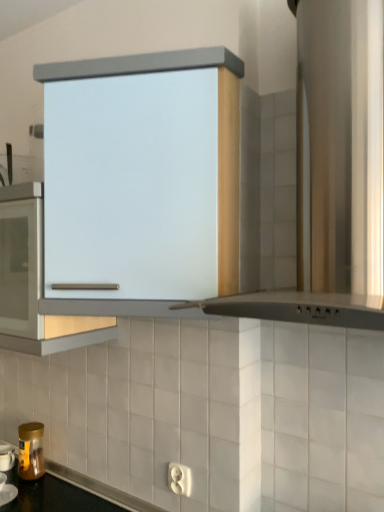
Locate an element on the screen. The width and height of the screenshot is (384, 512). satin white cabinet at center is located at coordinates (218, 128).

What is the approximate height of gold metallic jar at lower left?

7.99 inches.

This screenshot has height=512, width=384. In order to click on gold metallic jar at lower left in this screenshot , I will do `click(31, 451)`.

Where is `satin white cabinet at center`? The height and width of the screenshot is (512, 384). satin white cabinet at center is located at coordinates (218, 128).

Is satin silver hood at upper center oriented towards gold metallic jar at lower left?

No, satin silver hood at upper center is not turned towards gold metallic jar at lower left.

In the image, is satin silver hood at upper center positioned in front of or behind gold metallic jar at lower left?

In the image, satin silver hood at upper center appears in front of gold metallic jar at lower left.

From a real-world perspective, is satin silver hood at upper center beneath gold metallic jar at lower left?

No, from a real-world perspective, satin silver hood at upper center is not beneath gold metallic jar at lower left.

Consider the image. Is satin silver hood at upper center completely or partially outside of gold metallic jar at lower left?

That's correct, satin silver hood at upper center is outside of gold metallic jar at lower left.

Which is more to the left, gold metallic jar at lower left or satin silver hood at upper center?

gold metallic jar at lower left is more to the left.

In the scene shown: How far apart are gold metallic jar at lower left and satin silver hood at upper center?

They are 4.25 feet apart.

From the image's perspective, who appears lower, gold metallic jar at lower left or satin silver hood at upper center?

gold metallic jar at lower left.

Between gold metallic jar at lower left and satin silver hood at upper center, which one has more height?

With more height is satin silver hood at upper center.

Can you confirm if gold metallic jar at lower left is taller than satin white cabinet at center?

No, gold metallic jar at lower left is not taller than satin white cabinet at center.

Is gold metallic jar at lower left far away from satin white cabinet at center?

No, gold metallic jar at lower left is not far away from satin white cabinet at center.

Considering the relative sizes of gold metallic jar at lower left and satin white cabinet at center in the image provided, is gold metallic jar at lower left smaller than satin white cabinet at center?

Yes, gold metallic jar at lower left is smaller than satin white cabinet at center.

From the picture: Considering the sizes of objects gold metallic jar at lower left and satin white cabinet at center in the image provided, who is thinner, gold metallic jar at lower left or satin white cabinet at center?

Thinner between the two is gold metallic jar at lower left.

Between satin white cabinet at center and satin silver hood at upper center, which one has less height?

Standing shorter between the two is satin white cabinet at center.

From a real-world perspective, relative to satin silver hood at upper center, is satin white cabinet at center vertically above or below?

In terms of real-world spatial position, satin white cabinet at center is below satin silver hood at upper center.

Is satin white cabinet at center oriented away from satin silver hood at upper center?

satin white cabinet at center does not have its back to satin silver hood at upper center.

Is satin silver hood at upper center facing away from satin white cabinet at center?

No.

From the image's perspective, relative to satin white cabinet at center, is satin silver hood at upper center above or below?

Based on their image positions, satin silver hood at upper center is located above satin white cabinet at center.

Is satin silver hood at upper center shorter than satin white cabinet at center?

No.

How far apart are satin silver hood at upper center and satin white cabinet at center?

The distance of satin silver hood at upper center from satin white cabinet at center is 11.42 inches.

From a real-world perspective, which is physically above, satin white cabinet at center or gold metallic jar at lower left?

satin white cabinet at center is physically above.

Does point (219, 259) lie in front of point (26, 475)?

Yes, point (219, 259) is closer to viewer.

Is satin white cabinet at center not near gold metallic jar at lower left?

No.

The height and width of the screenshot is (512, 384). In order to click on home appliance above the gold metallic jar at lower left (from the image's perspective) in this screenshot , I will do `click(333, 173)`.

Identify the location of home appliance above the gold metallic jar at lower left (from a real-world perspective). (333, 173).

Which object lies further to the anchor point satin silver hood at upper center, gold metallic jar at lower left or satin white cabinet at center?

gold metallic jar at lower left is positioned further to the anchor satin silver hood at upper center.

Considering their positions, is satin silver hood at upper center positioned further to gold metallic jar at lower left than satin white cabinet at center?

satin silver hood at upper center is further to gold metallic jar at lower left.

When comparing their distances from satin white cabinet at center, does satin silver hood at upper center or gold metallic jar at lower left seem closer?

satin silver hood at upper center is positioned closer to the anchor satin white cabinet at center.

Considering their positions, is satin white cabinet at center positioned closer to satin silver hood at upper center than gold metallic jar at lower left?

satin white cabinet at center is closer to satin silver hood at upper center.

From the image, which object appears to be farther from satin white cabinet at center, gold metallic jar at lower left or satin silver hood at upper center?

gold metallic jar at lower left lies further to satin white cabinet at center than the other object.

Looking at this image, looking at the image, which one is located further to gold metallic jar at lower left, satin white cabinet at center or satin silver hood at upper center?

Among the two, satin silver hood at upper center is located further to gold metallic jar at lower left.

I want to click on cabinetry that lies between satin silver hood at upper center and gold metallic jar at lower left from top to bottom, so click(x=218, y=128).